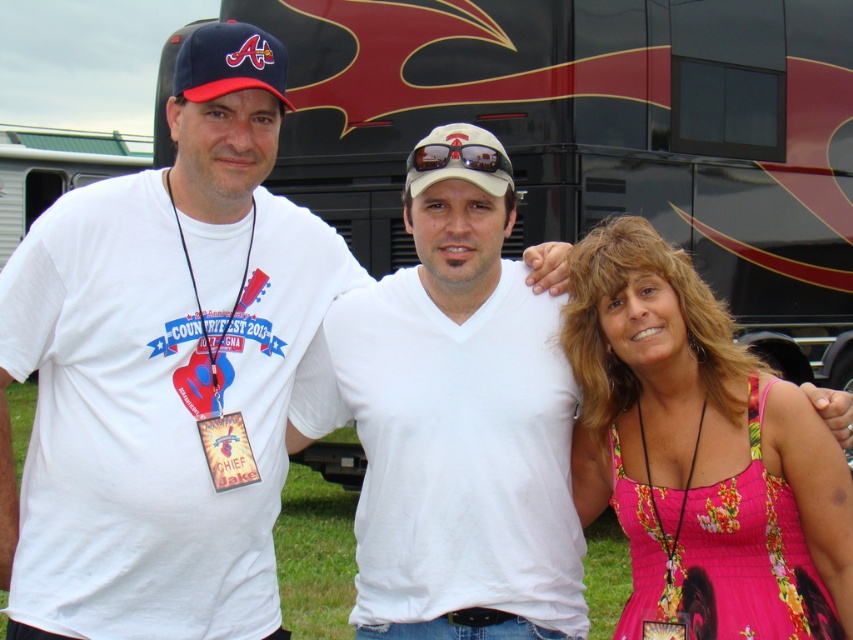
Question: Which is nearer to the white matte baseball cap at center?

Choices:
 (A) white matte t-shirt at center
 (B) white t-shirt at center
 (C) pink floral dress at center
 (D) matte fabric baseball cap at upper left

Answer: (D)

Question: Where is white matte t-shirt at center located in relation to matte fabric baseball cap at upper left in the image?

Choices:
 (A) below
 (B) above

Answer: (A)

Question: Can you confirm if white matte t-shirt at center is bigger than pink floral dress at center?

Choices:
 (A) no
 (B) yes

Answer: (B)

Question: Estimate the real-world distances between objects in this image. Which object is closer to the white t-shirt at center?

Choices:
 (A) white matte baseball cap at center
 (B) white matte t-shirt at center
 (C) pink floral dress at center
 (D) matte fabric baseball cap at upper left

Answer: (B)

Question: Which is farther from the matte fabric baseball cap at upper left?

Choices:
 (A) white matte t-shirt at center
 (B) white matte baseball cap at center
 (C) pink floral dress at center

Answer: (C)

Question: Can you confirm if white t-shirt at center is positioned to the left of pink floral dress at center?

Choices:
 (A) yes
 (B) no

Answer: (A)